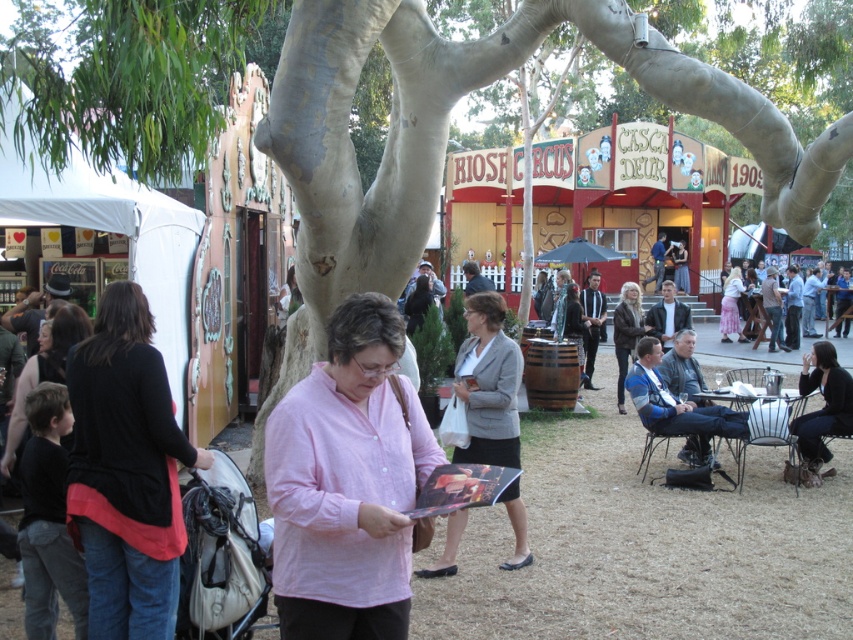
Where is `pink cotton shirt at center`? pink cotton shirt at center is located at coordinates (347, 483).

What do you see at coordinates (347, 483) in the screenshot? This screenshot has height=640, width=853. I see `pink cotton shirt at center` at bounding box center [347, 483].

Is point (357, 330) behind point (503, 460)?

That is False.

What are the coordinates of `pink cotton shirt at center` in the screenshot? It's located at (347, 483).

Measure the distance between pink cotton shirt at center and camera.

They are 4.10 meters apart.

Is point (383, 445) farther from camera compared to point (720, 310)?

That is False.

Locate an element on the screen. Image resolution: width=853 pixels, height=640 pixels. pink cotton shirt at center is located at coordinates (347, 483).

Measure the distance between black leather jacket at lower right and pink satin skirt at right.

15.76 meters

Where is `black leather jacket at lower right`? black leather jacket at lower right is located at coordinates point(824,404).